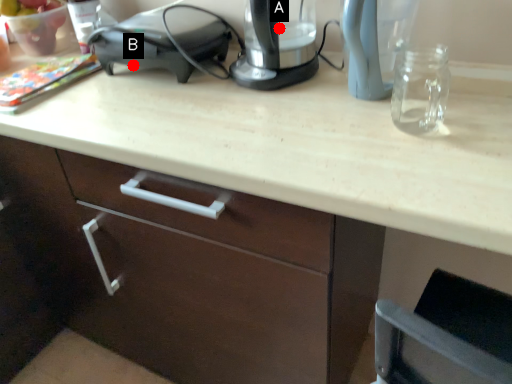
Question: Two points are circled on the image, labeled by A and B beside each circle. Among these points, which one is nearest to the camera?

Choices:
 (A) A is closer
 (B) B is closer

Answer: (A)